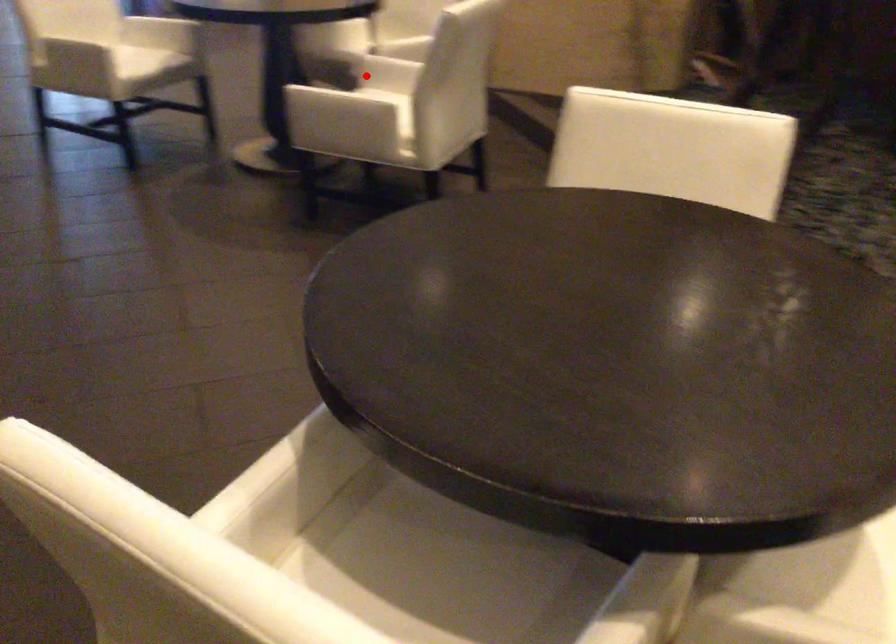
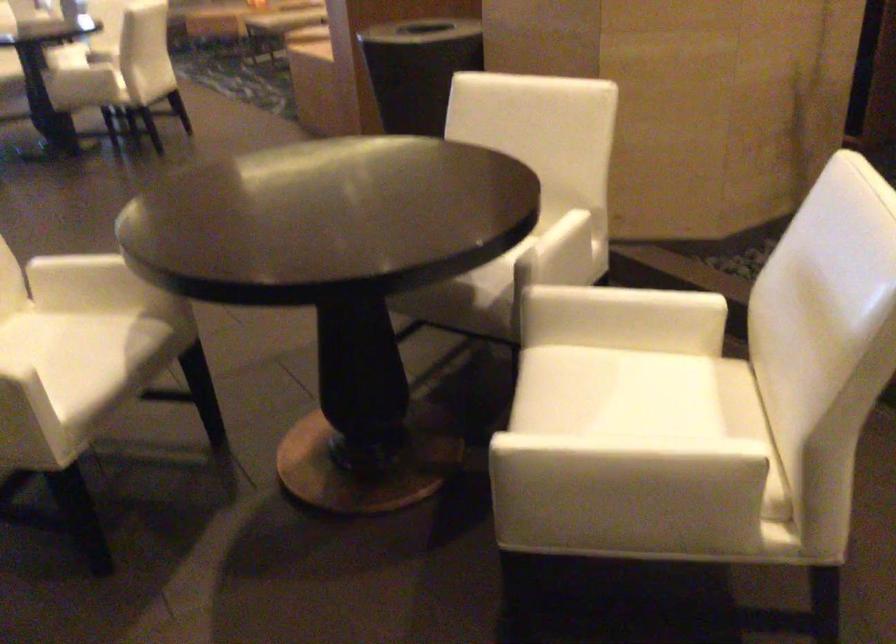
Find the pixel in the second image that matches the highlighted location in the first image.

(640, 393)